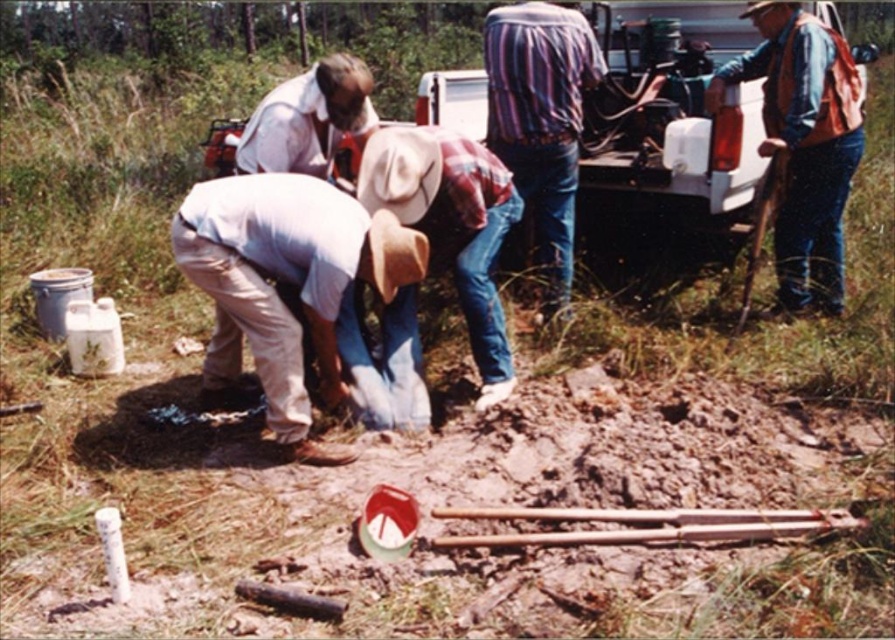
Based on the photo, you are part of a fieldwork team and need to locate two team members wearing the striped fabric shirt at center and the matte white shirt at center. According to the scene, which shirt is positioned to the right of the other?

The striped fabric shirt at center is to the right of the matte white shirt at center.

You are a field assistant who needs to locate the white cotton shirt at center quickly. Based on the scene described, where should you look relative to the brown canvas safety vest at right?

The brown canvas safety vest at right is above the white cotton shirt at center, so you should look below the brown canvas safety vest at right to find the white cotton shirt at center.